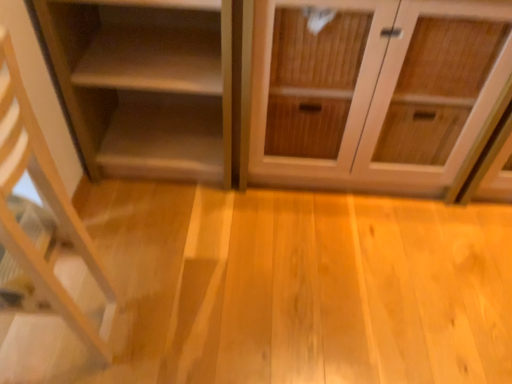
Question: From the image's perspective, is matte wood shelf at left, positioned as the first shelf in back-to-front order, above light wood shelf at left, the 2th shelf positioned from the back?

Choices:
 (A) no
 (B) yes

Answer: (B)

Question: Is matte wood shelf at left, positioned as the first shelf in back-to-front order, surrounding light wood shelf at left, which appears as the 1th shelf when viewed from the front?

Choices:
 (A) yes
 (B) no

Answer: (B)

Question: Is matte wood shelf at left, positioned as the first shelf in back-to-front order, behind light wood shelf at left, which appears as the 1th shelf when viewed from the front?

Choices:
 (A) no
 (B) yes

Answer: (B)

Question: Is matte wood shelf at left, the second shelf from the front, not near light wood shelf at left, the 2th shelf positioned from the back?

Choices:
 (A) no
 (B) yes

Answer: (A)

Question: From the image's perspective, is matte wood shelf at left, positioned as the first shelf in back-to-front order, located beneath light wood shelf at left, the 2th shelf positioned from the back?

Choices:
 (A) no
 (B) yes

Answer: (A)

Question: From their relative heights in the image, would you say wooden cabinet at center is taller or shorter than matte wood shelf at left, positioned as the first shelf in back-to-front order?

Choices:
 (A) short
 (B) tall

Answer: (B)

Question: Is wooden cabinet at center wider or thinner than matte wood shelf at left, positioned as the first shelf in back-to-front order?

Choices:
 (A) wide
 (B) thin

Answer: (A)

Question: Looking at the image, does wooden cabinet at center seem bigger or smaller compared to matte wood shelf at left, the second shelf from the front?

Choices:
 (A) big
 (B) small

Answer: (A)

Question: Which is correct: wooden cabinet at center is inside matte wood shelf at left, the second shelf from the front, or outside of it?

Choices:
 (A) inside
 (B) outside

Answer: (B)

Question: Considering the positions of wooden cabinet at center and light wood shelf at left, which appears as the 1th shelf when viewed from the front, in the image, is wooden cabinet at center taller or shorter than light wood shelf at left, which appears as the 1th shelf when viewed from the front,?

Choices:
 (A) tall
 (B) short

Answer: (B)

Question: Do you think wooden cabinet at center is within light wood shelf at left, which appears as the 1th shelf when viewed from the front, or outside of it?

Choices:
 (A) outside
 (B) inside

Answer: (A)

Question: Considering their positions, is wooden cabinet at center located in front of or behind light wood shelf at left, the 2th shelf positioned from the back?

Choices:
 (A) behind
 (B) front

Answer: (A)

Question: Looking at their shapes, would you say wooden cabinet at center is wider or thinner than light wood shelf at left, the 2th shelf positioned from the back?

Choices:
 (A) thin
 (B) wide

Answer: (B)

Question: Is light wood shelf at left, the 2th shelf positioned from the back, bigger or smaller than wooden cabinet at center?

Choices:
 (A) small
 (B) big

Answer: (A)

Question: In terms of height, does light wood shelf at left, the 2th shelf positioned from the back, look taller or shorter compared to wooden cabinet at center?

Choices:
 (A) tall
 (B) short

Answer: (A)